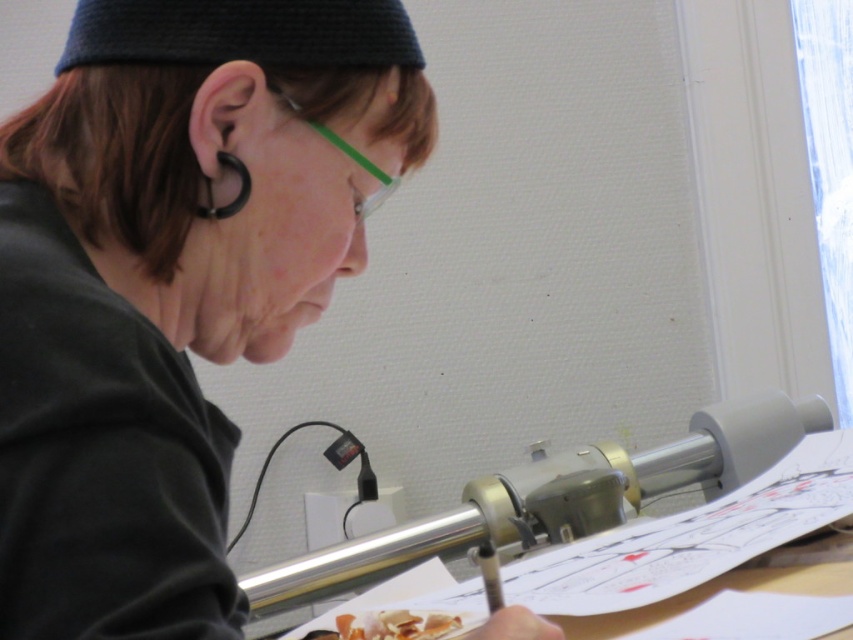
Question: Which of the following is the farthest from the observer?

Choices:
 (A) (428, 92)
 (B) (368, 170)

Answer: (A)

Question: Is black matte paper at center below slightly translucent paper at lower center?

Choices:
 (A) yes
 (B) no

Answer: (B)

Question: Which object is closer to the camera taking this photo?

Choices:
 (A) slightly translucent paper at lower center
 (B) clear plastic glasses at upper center

Answer: (B)

Question: Which is nearer to the black matte paper at center?

Choices:
 (A) clear plastic glasses at upper center
 (B) slightly translucent paper at lower center

Answer: (A)

Question: Does black matte paper at center come in front of clear plastic glasses at upper center?

Choices:
 (A) yes
 (B) no

Answer: (A)

Question: From the image, what is the correct spatial relationship of slightly translucent paper at lower center in relation to clear plastic glasses at upper center?

Choices:
 (A) above
 (B) below

Answer: (B)